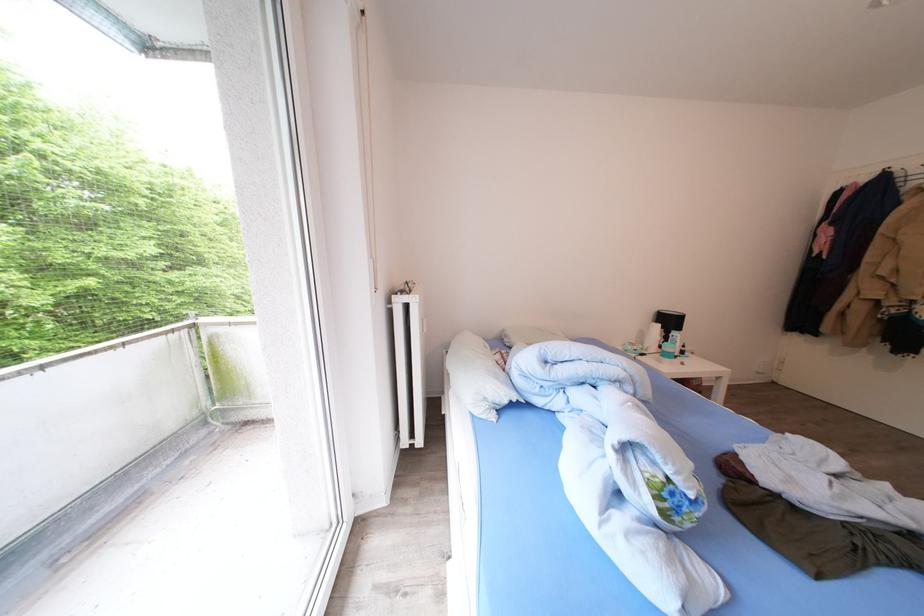
Describe the element at coordinates (367, 135) in the screenshot. The height and width of the screenshot is (616, 924). I see `the blind pull cord` at that location.